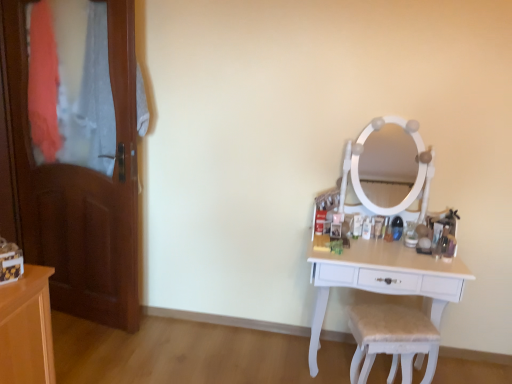
Question: From the image's perspective, is white fabric-covered chair at lower right above or below wooden door at left?

Choices:
 (A) below
 (B) above

Answer: (A)

Question: Visually, is white fabric-covered chair at lower right positioned to the left or to the right of wooden door at left?

Choices:
 (A) right
 (B) left

Answer: (A)

Question: Estimate the real-world distances between objects in this image. Which object is closer to the wooden door at left?

Choices:
 (A) white fabric-covered chair at lower right
 (B) white wood table at right

Answer: (B)

Question: Which of these objects is positioned farthest from the wooden door at left?

Choices:
 (A) white wood table at right
 (B) white fabric-covered chair at lower right

Answer: (B)